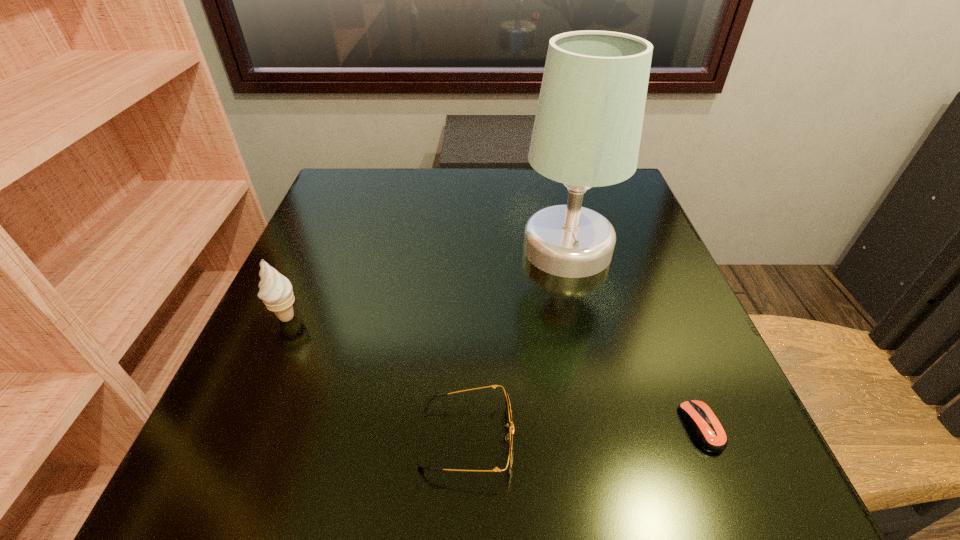
Locate an element on the screen. free space that satisfies the following two spatial constraints: 1. on the base of the tallest object; 2. on the back side of the rightmost object is located at coordinates (610, 427).

Image resolution: width=960 pixels, height=540 pixels. I want to click on free spot that satisfies the following two spatial constraints: 1. on the base of the farthest object; 2. on the front-facing side of the icecream, so click(x=584, y=317).

I want to click on free space that satisfies the following two spatial constraints: 1. on the base of the second object from right to left; 2. on the right side of the computer mouse, so click(x=610, y=427).

Locate an element on the screen. This screenshot has height=540, width=960. free space that satisfies the following two spatial constraints: 1. on the back side of the computer mouse; 2. on the base of the tallest object is located at coordinates (629, 248).

Locate an element on the screen. The height and width of the screenshot is (540, 960). vacant space that satisfies the following two spatial constraints: 1. on the base of the second object from right to left; 2. on the front-facing side of the third nearest object is located at coordinates (584, 317).

The image size is (960, 540). Find the location of `free space that satisfies the following two spatial constraints: 1. on the base of the tallest object; 2. on the front-facing side of the icecream`. free space that satisfies the following two spatial constraints: 1. on the base of the tallest object; 2. on the front-facing side of the icecream is located at coordinates (584, 317).